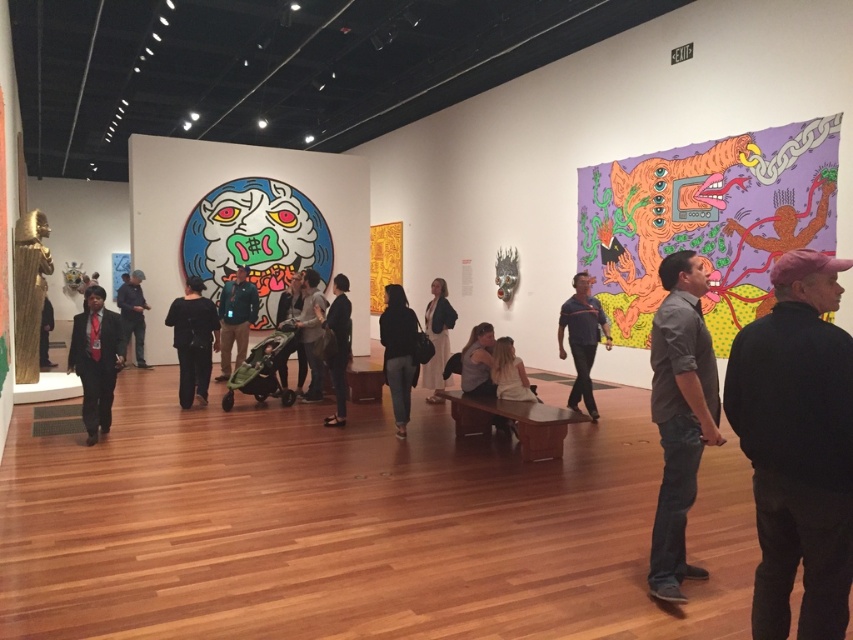
Question: Estimate the real-world distances between objects in this image. Which object is closer to the blue fabric shirt at center?

Choices:
 (A) dark gray suit at center
 (B) black matte pants at center

Answer: (A)

Question: Can you confirm if matte blue jacket at center is thinner than light gray cotton shirt at center?

Choices:
 (A) yes
 (B) no

Answer: (B)

Question: Is dark gray suit at center positioned at the back of light gray cotton shirt at center?

Choices:
 (A) yes
 (B) no

Answer: (B)

Question: Does matte black suit at left come in front of light gray cotton shirt at center?

Choices:
 (A) yes
 (B) no

Answer: (A)

Question: Which of the following is the farthest from the observer?

Choices:
 (A) (581, 388)
 (B) (410, 385)
 (C) (825, 326)
 (D) (334, 323)

Answer: (A)

Question: Which of the following is the closest to the observer?

Choices:
 (A) blue fabric shirt at center
 (B) light gray cotton shirt at center

Answer: (A)